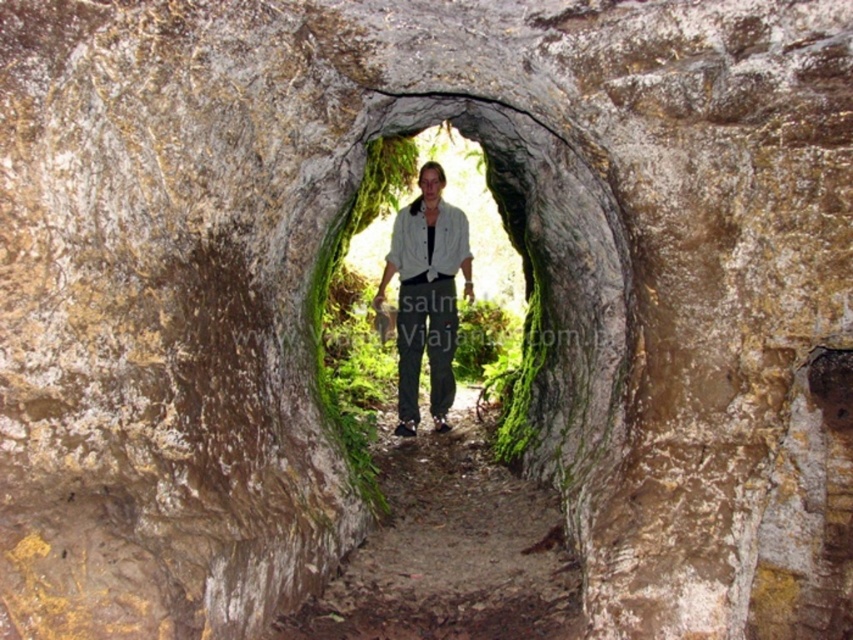
Can you confirm if green mossy rock at center is positioned below light gray shirt at center?

Yes.

Which of these two, green mossy rock at center or light gray shirt at center, stands shorter?

With less height is green mossy rock at center.

Is point (569, 461) more distant than point (399, 316)?

No, (569, 461) is in front of (399, 316).

Identify the location of green mossy rock at center. (556, 305).

Is dirt path at center thinner than light gray shirt at center?

No.

Does dirt path at center have a lesser height compared to light gray shirt at center?

Yes.

Between point (451, 499) and point (381, 275), which one is positioned in front?

Point (451, 499) is in front.

Image resolution: width=853 pixels, height=640 pixels. I want to click on dirt path at center, so click(450, 554).

Is green mossy rock at center to the right of dirt path at center from the viewer's perspective?

Yes, green mossy rock at center is to the right of dirt path at center.

Is point (538, 244) farther from camera compared to point (527, 500)?

Yes, it is.

Is point (357, 509) farther from camera compared to point (445, 548)?

Yes, it is behind point (445, 548).

Where is `green mossy rock at center`? green mossy rock at center is located at coordinates (556, 305).